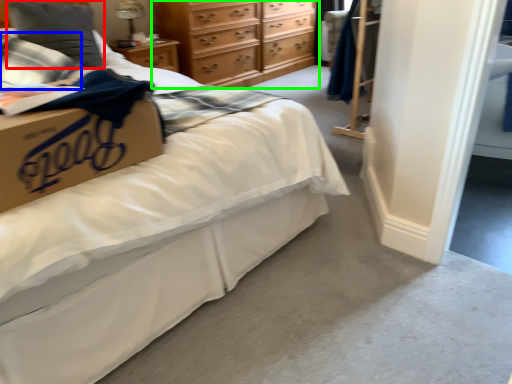
Question: Considering the real-world distances, which object is closest to pillow (highlighted by a red box)? pillow (highlighted by a blue box) or chest of drawers (highlighted by a green box).

Choices:
 (A) pillow
 (B) chest of drawers

Answer: (A)